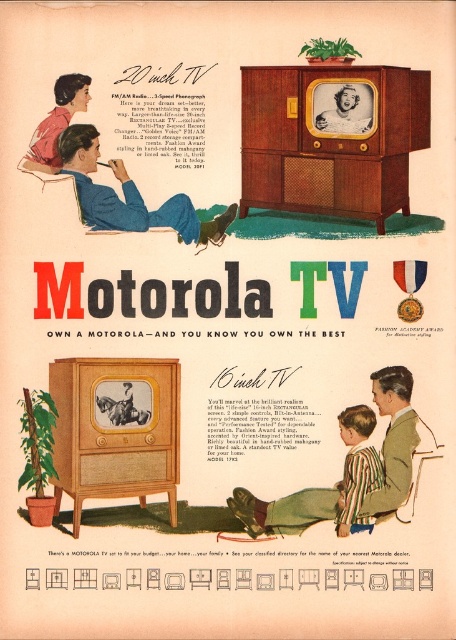
Question: Which object is farther from the camera taking this photo?

Choices:
 (A) striped fabric shirt at lower right
 (B) striped fabric shirt at lower center

Answer: (A)

Question: Is striped fabric shirt at lower right below matte pink blouse at upper left?

Choices:
 (A) yes
 (B) no

Answer: (A)

Question: Does blue fabric jacket at upper left come behind matte pink blouse at upper left?

Choices:
 (A) yes
 (B) no

Answer: (A)

Question: Which point appears closest to the camera in this image?

Choices:
 (A) (188, 230)
 (B) (351, 426)
 (C) (79, 97)

Answer: (C)

Question: Which of the following is the farthest from the observer?

Choices:
 (A) (161, 205)
 (B) (249, 515)

Answer: (A)

Question: Is striped fabric shirt at lower right wider than matte pink blouse at upper left?

Choices:
 (A) no
 (B) yes

Answer: (A)